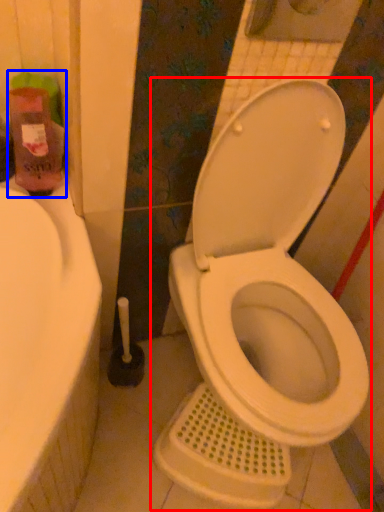
Question: Which of the following is the farthest to the observer, toilet (highlighted by a red box) or cleaning product (highlighted by a blue box)?

Choices:
 (A) toilet
 (B) cleaning product

Answer: (B)